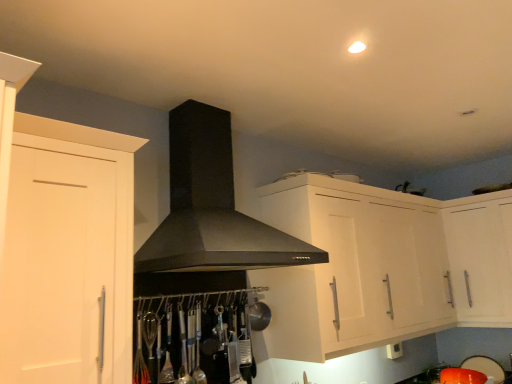
What do you see at coordinates (485, 367) in the screenshot? The image size is (512, 384). I see `orange plastic bowl at lower right, the 1th appliance in the right-to-left sequence` at bounding box center [485, 367].

What do you see at coordinates (212, 207) in the screenshot? This screenshot has width=512, height=384. I see `black matte fume hood at center` at bounding box center [212, 207].

Image resolution: width=512 pixels, height=384 pixels. In order to click on white matte cabinet at left, which ranks as the 2th cabinetry in right-to-left order in this screenshot , I will do `click(63, 245)`.

Identify the location of orange matte bowl at lower right, which ranks as the second appliance in right-to-left order. (462, 376).

Image resolution: width=512 pixels, height=384 pixels. In order to click on white glossy cabinet at upper right, which is the first cabinetry in back-to-front order in this screenshot , I will do `click(382, 267)`.

Is orange plastic bowl at lower right, the 1th appliance in the right-to-left sequence, positioned far away from black matte fume hood at center?

Yes, orange plastic bowl at lower right, the 1th appliance in the right-to-left sequence, and black matte fume hood at center are quite far apart.

The image size is (512, 384). What are the coordinates of `the 2nd appliance below when counting from the black matte fume hood at center (from the image's perspective)` in the screenshot? It's located at (485, 367).

Choose the correct answer: Is orange plastic bowl at lower right, the 2th appliance from the left, inside black matte fume hood at center or outside it?

The correct answer is: outside.

Between white matte cabinet at left, which is the second cabinetry from back to front, and black matte fume hood at center, which one appears on the left side from the viewer's perspective?

From the viewer's perspective, white matte cabinet at left, which is the second cabinetry from back to front, appears more on the left side.

Is there a large distance between white matte cabinet at left, which ranks as the first cabinetry in front-to-back order, and black matte fume hood at center?

white matte cabinet at left, which ranks as the first cabinetry in front-to-back order, is near black matte fume hood at center, not far away.

From the picture: From the image's perspective, relative to black matte fume hood at center, is white matte cabinet at left, which is the first cabinetry in left-to-right order, above or below?

white matte cabinet at left, which is the first cabinetry in left-to-right order, is situated lower than black matte fume hood at center in the image.

Are orange matte bowl at lower right, which ranks as the second appliance in right-to-left order, and white glossy cabinet at upper right, which is the first cabinetry in back-to-front order, making contact?

They are not placed beside each other.

Considering their positions, is orange matte bowl at lower right, which ranks as the second appliance in right-to-left order, located in front of or behind white glossy cabinet at upper right, the 2th cabinetry in the left-to-right sequence?

In the image, orange matte bowl at lower right, which ranks as the second appliance in right-to-left order, appears behind white glossy cabinet at upper right, the 2th cabinetry in the left-to-right sequence.

Is point (451, 375) closer or farther from the camera than point (506, 231)?

Clearly, point (451, 375) is more distant from the camera than point (506, 231).

Can you see white glossy cabinet at upper right, which is the first cabinetry in back-to-front order, touching orange matte bowl at lower right, placed as the 1th appliance when sorted from left to right?

white glossy cabinet at upper right, which is the first cabinetry in back-to-front order, is not next to orange matte bowl at lower right, placed as the 1th appliance when sorted from left to right, and they're not touching.

From a real-world perspective, who is located lower, white glossy cabinet at upper right, which is the first cabinetry in right-to-left order, or orange matte bowl at lower right, which ranks as the second appliance in right-to-left order?

In real-world perspective, orange matte bowl at lower right, which ranks as the second appliance in right-to-left order, is lower.

Would you say white glossy cabinet at upper right, the second cabinetry when ordered from front to back, is to the left or to the right of orange matte bowl at lower right, placed as the 1th appliance when sorted from left to right, in the picture?

Clearly, white glossy cabinet at upper right, the second cabinetry when ordered from front to back, is on the left of orange matte bowl at lower right, placed as the 1th appliance when sorted from left to right, in the image.

Is white glossy cabinet at upper right, the second cabinetry when ordered from front to back, inside or outside of orange matte bowl at lower right, placed as the 1th appliance when sorted from left to right?

white glossy cabinet at upper right, the second cabinetry when ordered from front to back, cannot be found inside orange matte bowl at lower right, placed as the 1th appliance when sorted from left to right.

From a real-world perspective, is white glossy cabinet at upper right, the second cabinetry when ordered from front to back, on white matte cabinet at left, which ranks as the first cabinetry in front-to-back order?

Incorrect, from a real-world perspective, white glossy cabinet at upper right, the second cabinetry when ordered from front to back, is lower than white matte cabinet at left, which ranks as the first cabinetry in front-to-back order.

Can you confirm if white glossy cabinet at upper right, which is the first cabinetry in back-to-front order, is positioned to the right of white matte cabinet at left, which ranks as the 2th cabinetry in right-to-left order?

Indeed, white glossy cabinet at upper right, which is the first cabinetry in back-to-front order, is positioned on the right side of white matte cabinet at left, which ranks as the 2th cabinetry in right-to-left order.

Would you consider white glossy cabinet at upper right, the 2th cabinetry in the left-to-right sequence, to be distant from white matte cabinet at left, which ranks as the 2th cabinetry in right-to-left order?

Absolutely, white glossy cabinet at upper right, the 2th cabinetry in the left-to-right sequence, is distant from white matte cabinet at left, which ranks as the 2th cabinetry in right-to-left order.

Is point (301, 270) positioned after point (59, 330)?

Yes, it is behind point (59, 330).

Is black matte fume hood at center to the left or to the right of white glossy cabinet at upper right, which is the first cabinetry in back-to-front order, in the image?

black matte fume hood at center is to the left of white glossy cabinet at upper right, which is the first cabinetry in back-to-front order.

Between black matte fume hood at center and white glossy cabinet at upper right, which is the first cabinetry in right-to-left order, which one has larger width?

With larger width is black matte fume hood at center.

Measure the distance from black matte fume hood at center to white glossy cabinet at upper right, the second cabinetry when ordered from front to back.

black matte fume hood at center is 65.12 centimeters away from white glossy cabinet at upper right, the second cabinetry when ordered from front to back.

Identify the location of cabinetry lying behind the black matte fume hood at center. (382, 267).

From a real-world perspective, is white glossy cabinet at upper right, which is the first cabinetry in right-to-left order, located higher than black matte fume hood at center?

No, from a real-world perspective, white glossy cabinet at upper right, which is the first cabinetry in right-to-left order, is not over black matte fume hood at center

Is there a large distance between white glossy cabinet at upper right, which is the first cabinetry in right-to-left order, and black matte fume hood at center?

No, white glossy cabinet at upper right, which is the first cabinetry in right-to-left order, is in close proximity to black matte fume hood at center.

In the image, is white glossy cabinet at upper right, the 2th cabinetry in the left-to-right sequence, positioned in front of or behind black matte fume hood at center?

In the image, white glossy cabinet at upper right, the 2th cabinetry in the left-to-right sequence, appears behind black matte fume hood at center.

You are a GUI agent. You are given a task and a screenshot of the screen. Output one action in this format:
    pyautogui.click(x=<x>, y=<y>)
    Task: Click on the 2nd appliance below the black matte fume hood at center (from the image's perspective)
    
    Given the screenshot: What is the action you would take?
    pyautogui.click(x=485, y=367)

Find the location of `fume hood that appears behind the white matte cabinet at left, which is the first cabinetry in left-to-right order`. fume hood that appears behind the white matte cabinet at left, which is the first cabinetry in left-to-right order is located at coordinates (212, 207).

From the picture: When comparing their distances from white glossy cabinet at upper right, which is the first cabinetry in right-to-left order, does white matte cabinet at left, which is the second cabinetry from back to front, or black matte fume hood at center seem closer?

Among the two, black matte fume hood at center is located nearer to white glossy cabinet at upper right, which is the first cabinetry in right-to-left order.

When comparing their distances from white glossy cabinet at upper right, the 2th cabinetry in the left-to-right sequence, does black matte fume hood at center or orange matte bowl at lower right, placed as the 1th appliance when sorted from left to right, seem further?

Based on the image, orange matte bowl at lower right, placed as the 1th appliance when sorted from left to right, appears to be further to white glossy cabinet at upper right, the 2th cabinetry in the left-to-right sequence.

Estimate the real-world distances between objects in this image. Which object is further from black matte fume hood at center, white matte cabinet at left, which is the second cabinetry from back to front, or orange plastic bowl at lower right, the 1th appliance in the right-to-left sequence?

orange plastic bowl at lower right, the 1th appliance in the right-to-left sequence, is further to black matte fume hood at center.

Looking at the image, which one is located further to orange plastic bowl at lower right, the 1th appliance in the right-to-left sequence, black matte fume hood at center or white matte cabinet at left, which is the second cabinetry from back to front?

white matte cabinet at left, which is the second cabinetry from back to front, is positioned further to the anchor orange plastic bowl at lower right, the 1th appliance in the right-to-left sequence.

Based on their spatial positions, is black matte fume hood at center or orange plastic bowl at lower right, the 2th appliance from the left, further from white glossy cabinet at upper right, which is the first cabinetry in right-to-left order?

Among the two, orange plastic bowl at lower right, the 2th appliance from the left, is located further to white glossy cabinet at upper right, which is the first cabinetry in right-to-left order.

Which object lies further to the anchor point orange plastic bowl at lower right, the 2th appliance from the left, white glossy cabinet at upper right, the 2th cabinetry in the left-to-right sequence, or white matte cabinet at left, which ranks as the 2th cabinetry in right-to-left order?

white matte cabinet at left, which ranks as the 2th cabinetry in right-to-left order, lies further to orange plastic bowl at lower right, the 2th appliance from the left, than the other object.

Looking at the image, which one is located closer to orange plastic bowl at lower right, the 1th appliance in the right-to-left sequence, white glossy cabinet at upper right, the 2th cabinetry in the left-to-right sequence, or orange matte bowl at lower right, which ranks as the second appliance in right-to-left order?

orange matte bowl at lower right, which ranks as the second appliance in right-to-left order, is positioned closer to the anchor orange plastic bowl at lower right, the 1th appliance in the right-to-left sequence.

From the image, which object appears to be nearer to orange plastic bowl at lower right, the 2th appliance from the left, white matte cabinet at left, which ranks as the first cabinetry in front-to-back order, or black matte fume hood at center?

Among the two, black matte fume hood at center is located nearer to orange plastic bowl at lower right, the 2th appliance from the left.

The width and height of the screenshot is (512, 384). I want to click on cabinetry between black matte fume hood at center and orange matte bowl at lower right, placed as the 1th appliance when sorted from left to right, in the horizontal direction, so click(382, 267).

In order to click on cabinetry between black matte fume hood at center and orange plastic bowl at lower right, the 1th appliance in the right-to-left sequence in this screenshot , I will do `click(382, 267)`.

Locate an element on the screen. appliance between white matte cabinet at left, which is the first cabinetry in left-to-right order, and orange plastic bowl at lower right, the 1th appliance in the right-to-left sequence is located at coordinates (462, 376).

The height and width of the screenshot is (384, 512). Identify the location of fume hood located between white matte cabinet at left, which is the second cabinetry from back to front, and white glossy cabinet at upper right, which is the first cabinetry in right-to-left order, in the left-right direction. (212, 207).